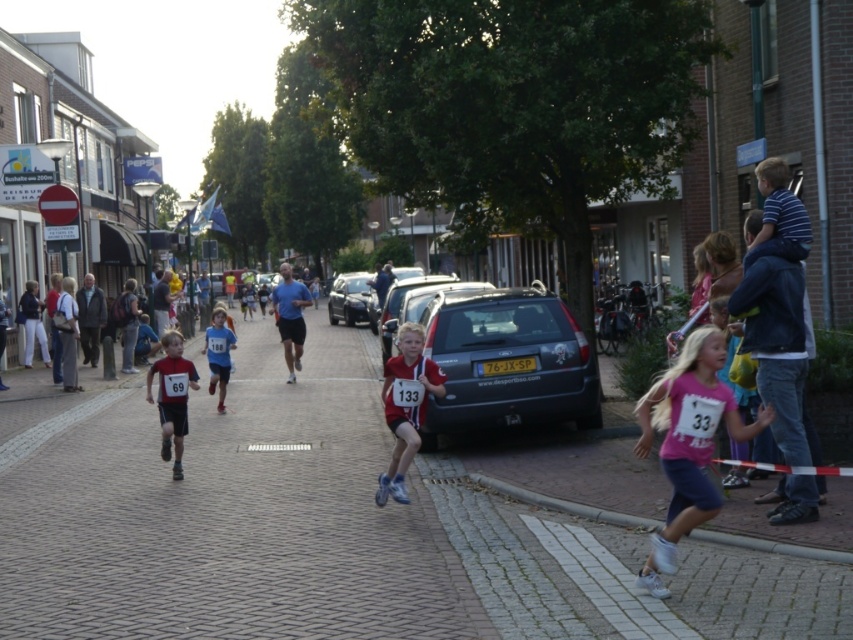
Is point (399, 376) farther from viewer compared to point (215, 321)?

That is False.

Consider the image. Who is more forward, (419, 380) or (227, 365)?

Positioned in front is point (419, 380).

Find the location of `red matte shirt at center`. red matte shirt at center is located at coordinates (405, 404).

Does pink fabric shirt at center appear over red matte shirt at center?

Indeed, pink fabric shirt at center is positioned over red matte shirt at center.

Is pink fabric shirt at center to the left of red matte shirt at center from the viewer's perspective?

Incorrect, pink fabric shirt at center is not on the left side of red matte shirt at center.

Is point (682, 451) farther from viewer compared to point (440, 387)?

No, (682, 451) is closer to viewer.

You are a GUI agent. You are given a task and a screenshot of the screen. Output one action in this format:
    pyautogui.click(x=<x>, y=<y>)
    Task: Click on the pink fabric shirt at center
    
    Given the screenshot: What is the action you would take?
    pyautogui.click(x=688, y=442)

Is pink fabric shirt at center smaller than blue jersey at center?

Yes, pink fabric shirt at center is smaller than blue jersey at center.

You are a GUI agent. You are given a task and a screenshot of the screen. Output one action in this format:
    pyautogui.click(x=<x>, y=<y>)
    Task: Click on the pink fabric shirt at center
    The height and width of the screenshot is (640, 853).
    Given the screenshot: What is the action you would take?
    pyautogui.click(x=688, y=442)